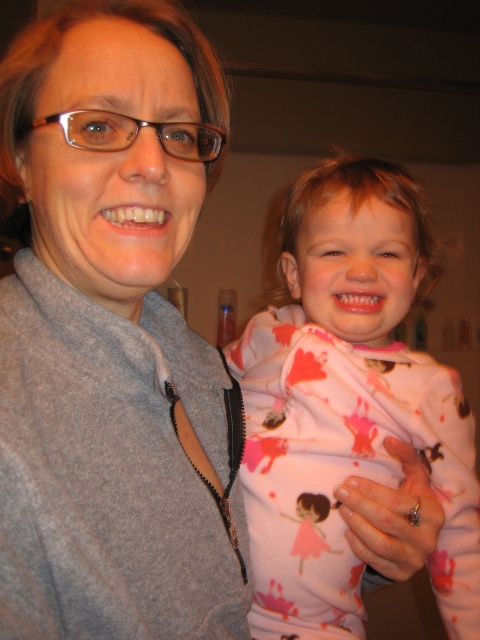
Question: Does gray fleece jacket at left have a smaller size compared to pink fleece pajamas at right?

Choices:
 (A) no
 (B) yes

Answer: (B)

Question: Where is gray fleece jacket at left located in relation to pink fleece pajamas at right in the image?

Choices:
 (A) above
 (B) below

Answer: (A)

Question: Considering the relative positions of gray fleece jacket at left and pink fleece pajamas at right in the image provided, where is gray fleece jacket at left located with respect to pink fleece pajamas at right?

Choices:
 (A) left
 (B) right

Answer: (A)